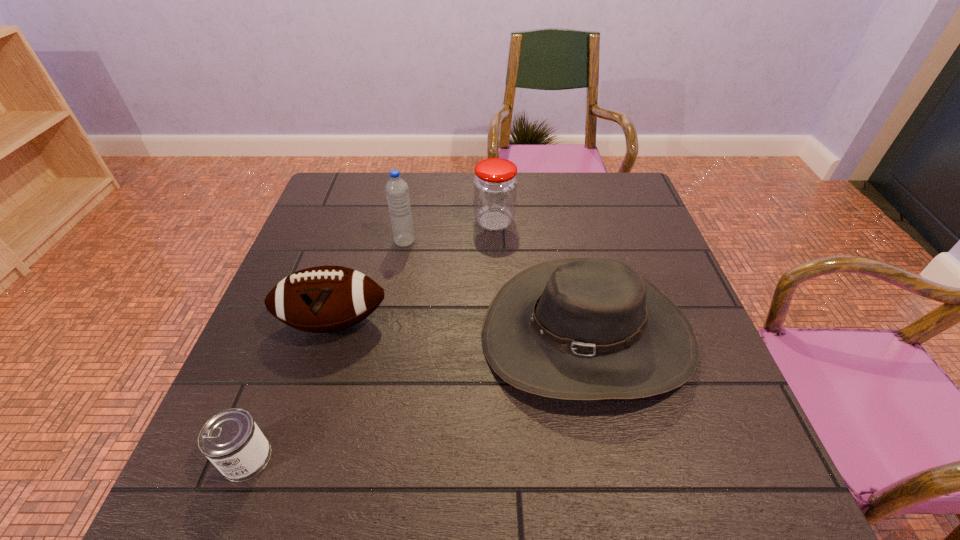
The height and width of the screenshot is (540, 960). What are the coordinates of `water bottle` in the screenshot? It's located at (397, 191).

Find the location of `the tallest object`. the tallest object is located at coordinates (397, 191).

Image resolution: width=960 pixels, height=540 pixels. I want to click on jar, so click(x=495, y=185).

This screenshot has height=540, width=960. What are the coordinates of `cowboy hat` in the screenshot? It's located at (580, 329).

Locate an element on the screen. The image size is (960, 540). football (American) is located at coordinates click(x=323, y=299).

Locate an element on the screen. This screenshot has height=540, width=960. the shortest object is located at coordinates coord(231,440).

This screenshot has width=960, height=540. In order to click on the nearest object in this screenshot , I will do `click(231, 440)`.

The width and height of the screenshot is (960, 540). I want to click on free location located on the back of the tallest object, so click(x=411, y=210).

I want to click on vacant space located on the front of the jar, so click(498, 319).

You are a GUI agent. You are given a task and a screenshot of the screen. Output one action in this format:
    pyautogui.click(x=<x>, y=<y>)
    Task: Click on the vacant position located on the front-facing side of the cowboy hat
    
    Given the screenshot: What is the action you would take?
    pyautogui.click(x=618, y=482)